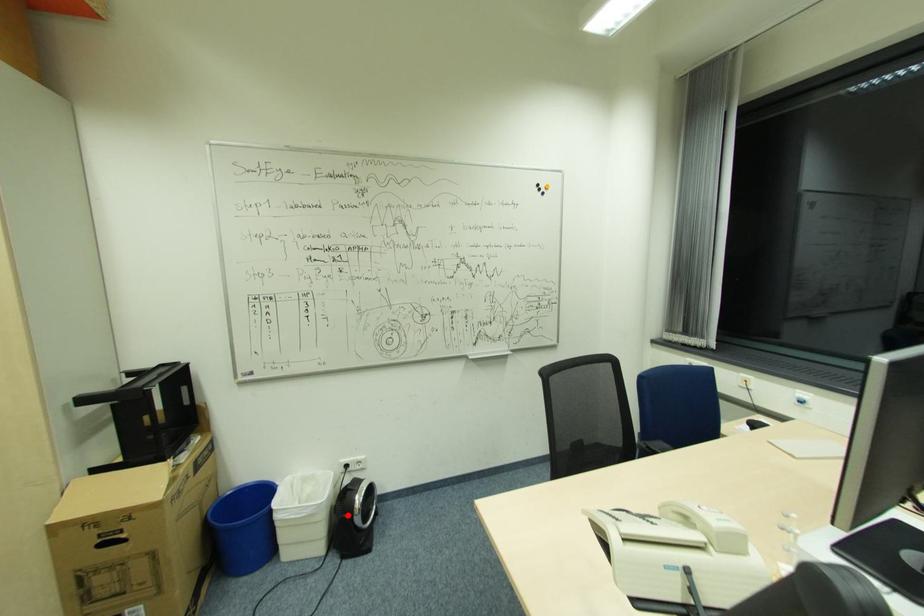
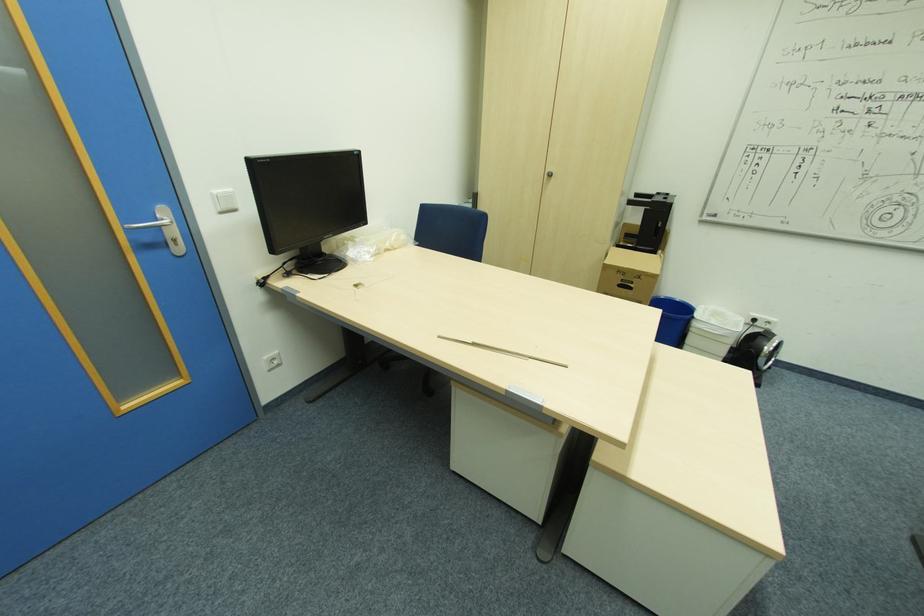
Question: I am providing you with two images of the same scene from different viewpoints. Image1 has a red point marked. In image2, the corresponding 3D location appears at what relative position? Reply with the corresponding letter.

Choices:
 (A) Closer
 (B) Farther

Answer: (A)